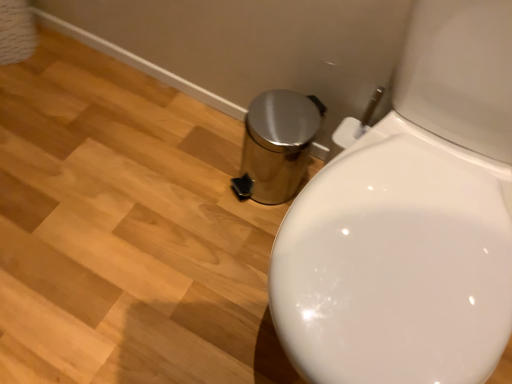
You are a GUI agent. You are given a task and a screenshot of the screen. Output one action in this format:
    pyautogui.click(x=<x>, y=<y>)
    Task: Click on the satin chrome bidet at lower right
    The image size is (512, 384).
    Given the screenshot: What is the action you would take?
    pyautogui.click(x=396, y=263)

What do you see at coordinates (396, 263) in the screenshot?
I see `satin chrome bidet at lower right` at bounding box center [396, 263].

The image size is (512, 384). I want to click on satin chrome bidet at lower right, so click(x=396, y=263).